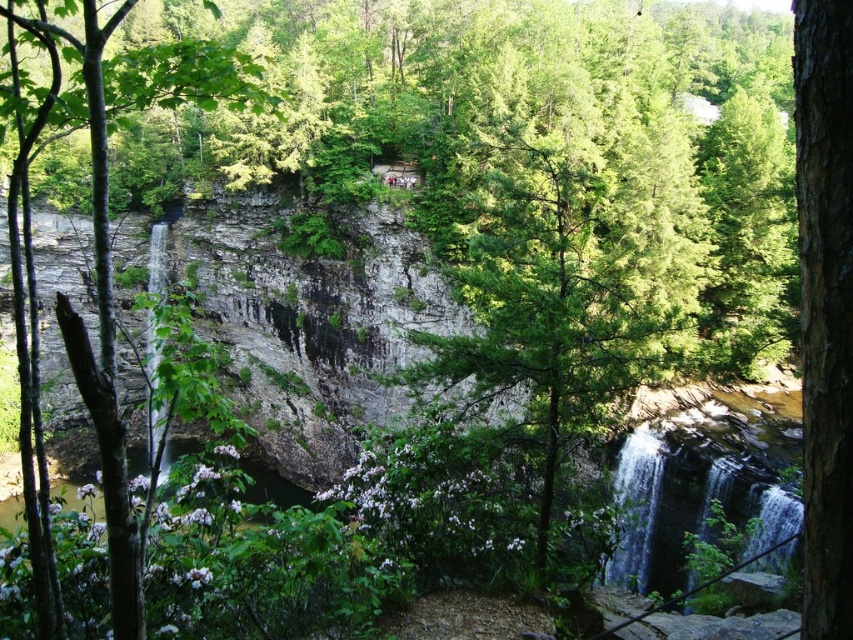
Does green leafy tree at center have a greater height compared to brown rough bark tree at center-left?

Yes, green leafy tree at center is taller than brown rough bark tree at center-left.

Is green leafy tree at center positioned at the back of brown rough bark tree at center-left?

No.

Measure the distance between green leafy tree at center and camera.

green leafy tree at center is 31.17 feet from camera.

At what (x,y) coordinates should I click in order to perform the action: click on green leafy tree at center. Please return your answer as a coordinate pair (x, y). This screenshot has height=640, width=853. Looking at the image, I should click on (107, 208).

Is green textured tree at center bigger than brown rough bark tree at center-left?

Indeed, green textured tree at center has a larger size compared to brown rough bark tree at center-left.

Can you confirm if green textured tree at center is smaller than brown rough bark tree at center-left?

Incorrect, green textured tree at center is not smaller in size than brown rough bark tree at center-left.

Between point (566, 364) and point (827, 244), which one is positioned behind?

Positioned behind is point (566, 364).

Identify the location of green textured tree at center. This screenshot has width=853, height=640. (575, 288).

Does green textured tree at center appear over green leafy tree at center?

Incorrect, green textured tree at center is not positioned above green leafy tree at center.

Between green textured tree at center and green leafy tree at center, which one is positioned higher?

green leafy tree at center

Is point (469, 288) less distant than point (42, 36)?

No, (469, 288) is behind (42, 36).

In order to click on green textured tree at center in this screenshot , I will do `click(575, 288)`.